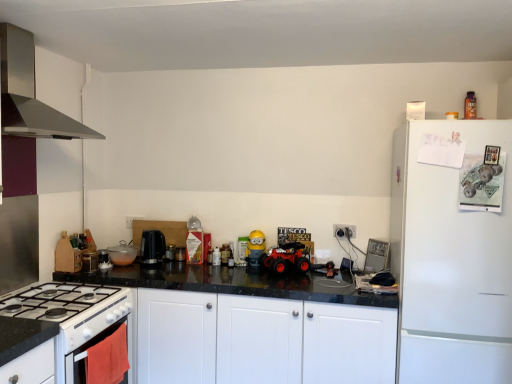
The image size is (512, 384). Identify the location of empty space that is ontop of stainless steel range hood at upper left, which is the 1th kitchen appliance in top-to-bottom order (from a real-world perspective). point(46,24).